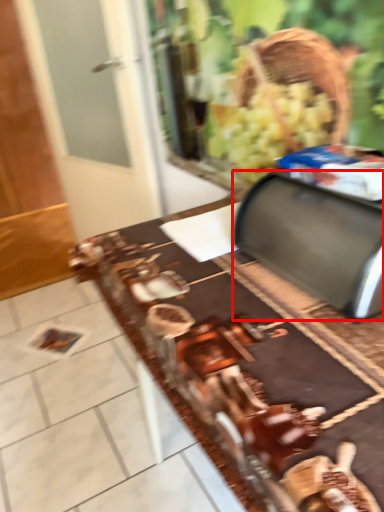
Question: Observing the image, what is the correct spatial positioning of wide (annotated by the red box) in reference to table?

Choices:
 (A) right
 (B) left

Answer: (A)